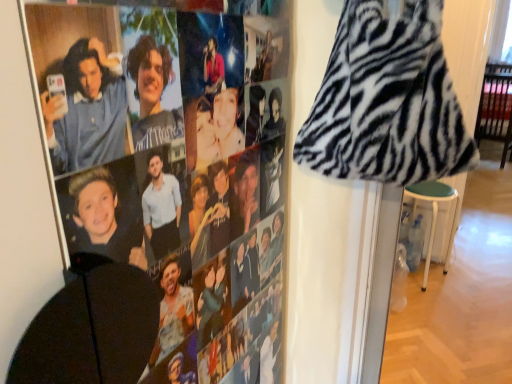
Question: Are zebra print fabric at upper right and green fabric stool at lower right far apart?

Choices:
 (A) yes
 (B) no

Answer: (A)

Question: Is zebra print fabric at upper right surrounding green fabric stool at lower right?

Choices:
 (A) no
 (B) yes

Answer: (A)

Question: Considering the relative positions of zebra print fabric at upper right and green fabric stool at lower right in the image provided, is zebra print fabric at upper right to the right of green fabric stool at lower right from the viewer's perspective?

Choices:
 (A) no
 (B) yes

Answer: (A)

Question: Can you confirm if zebra print fabric at upper right is bigger than green fabric stool at lower right?

Choices:
 (A) no
 (B) yes

Answer: (A)

Question: Could you tell me if zebra print fabric at upper right is facing green fabric stool at lower right?

Choices:
 (A) no
 (B) yes

Answer: (A)

Question: From a real-world perspective, is zebra print fabric at upper right below green fabric stool at lower right?

Choices:
 (A) yes
 (B) no

Answer: (B)

Question: From a real-world perspective, is green fabric stool at lower right on zebra print fabric at upper right?

Choices:
 (A) yes
 (B) no

Answer: (B)

Question: Is green fabric stool at lower right wider than zebra print fabric at upper right?

Choices:
 (A) no
 (B) yes

Answer: (B)

Question: From the image's perspective, is green fabric stool at lower right over zebra print fabric at upper right?

Choices:
 (A) no
 (B) yes

Answer: (A)

Question: Does green fabric stool at lower right have a lesser height compared to zebra print fabric at upper right?

Choices:
 (A) yes
 (B) no

Answer: (B)

Question: Is green fabric stool at lower right completely or partially outside of zebra print fabric at upper right?

Choices:
 (A) yes
 (B) no

Answer: (A)

Question: From a real-world perspective, does green fabric stool at lower right sit lower than zebra print fabric at upper right?

Choices:
 (A) yes
 (B) no

Answer: (A)

Question: Does zebra print hoodie at upper left have a greater width compared to green fabric stool at lower right?

Choices:
 (A) no
 (B) yes

Answer: (A)